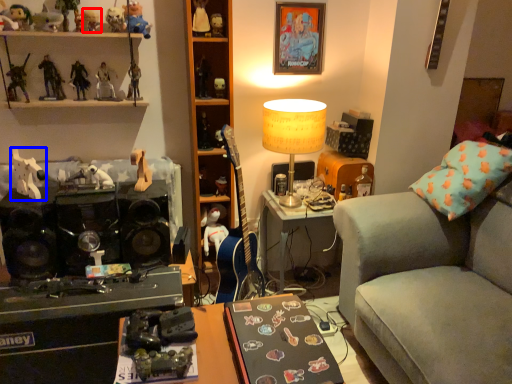
Question: Which object appears farthest to the camera in this image, toy (highlighted by a red box) or toy (highlighted by a blue box)?

Choices:
 (A) toy
 (B) toy

Answer: (A)